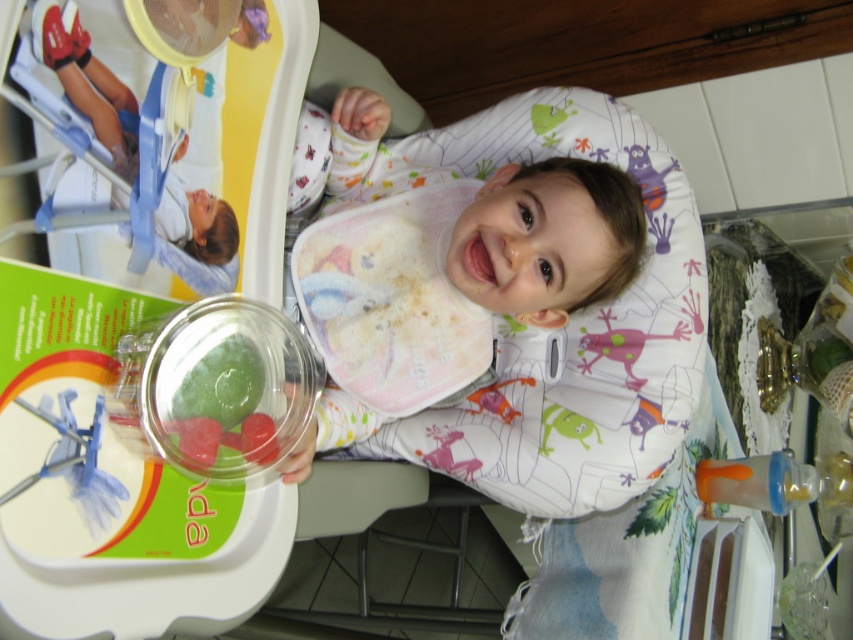
You are a parent trying to feed your baby using the clear plastic spoon at upper left. The green translucent gummy at center is on the tray. Can you reach the gummy with the spoon without moving the spoon?

Result: The clear plastic spoon at upper left is 4.65 inches away from the green translucent gummy at center. Since the spoon is not long enough to reach that distance, you cannot reach the gummy with the spoon without moving it.

You are a parent trying to choose between placing a white fabric bib at center or a clear plastic spoon at upper left on the high chair tray. Based on their sizes, which item would you choose to place first if you want to prioritize the larger item?

The white fabric bib at center has a greater width than the clear plastic spoon at upper left, so you should place the white fabric bib at center first to prioritize the larger item.

You are a parent trying to reach for the clear plastic spoon at upper left while holding your baby in the white fabric bib at center. Can you safely grab the spoon without moving the baby?

The white fabric bib at center is taller than the clear plastic spoon at upper left, so the spoon is shorter. Since the spoon is shorter, you can safely reach for it without moving the baby.